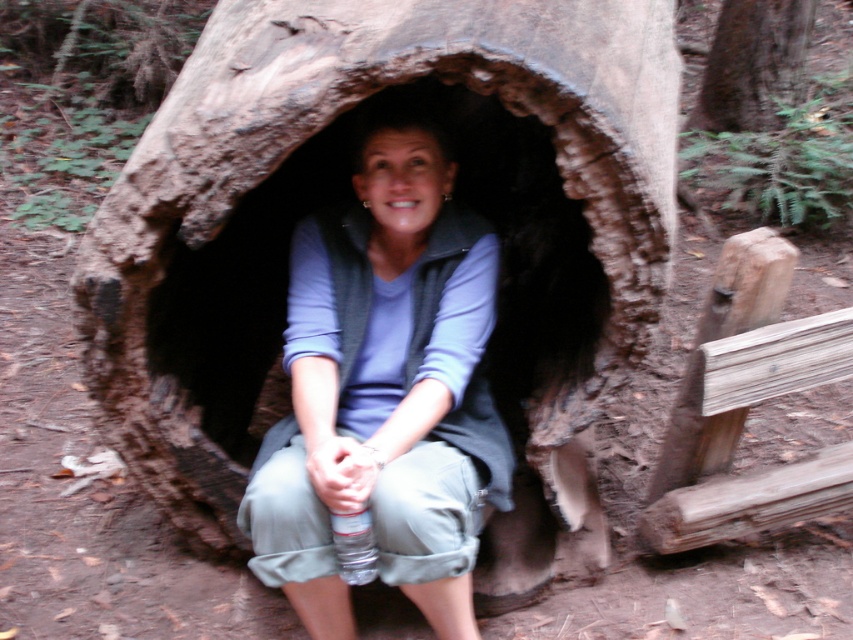
Question: Is matte gray vest at center bigger than brown rough bark at upper center?

Choices:
 (A) yes
 (B) no

Answer: (A)

Question: Among these points, which one is nearest to the camera?

Choices:
 (A) (450, 586)
 (B) (740, 83)

Answer: (A)

Question: Which point is farther to the camera?

Choices:
 (A) (323, 492)
 (B) (788, 0)

Answer: (B)

Question: Which of the following is the closest to the observer?

Choices:
 (A) brown rough bark at upper center
 (B) matte gray vest at center

Answer: (B)

Question: Observing the image, what is the correct spatial positioning of matte gray vest at center in reference to brown rough bark at upper center?

Choices:
 (A) right
 (B) left

Answer: (B)

Question: Does matte gray vest at center have a lesser width compared to brown rough bark at upper center?

Choices:
 (A) yes
 (B) no

Answer: (A)